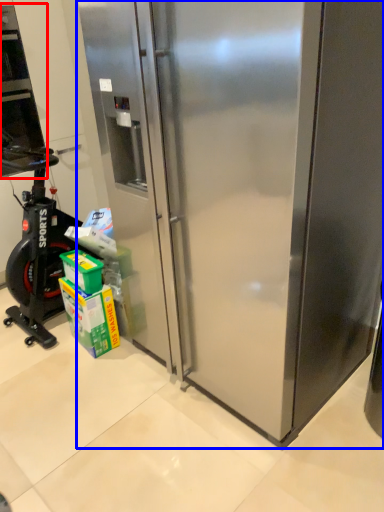
Question: Which object is further to the camera taking this photo, home appliance (highlighted by a red box) or refrigerator (highlighted by a blue box)?

Choices:
 (A) home appliance
 (B) refrigerator

Answer: (A)